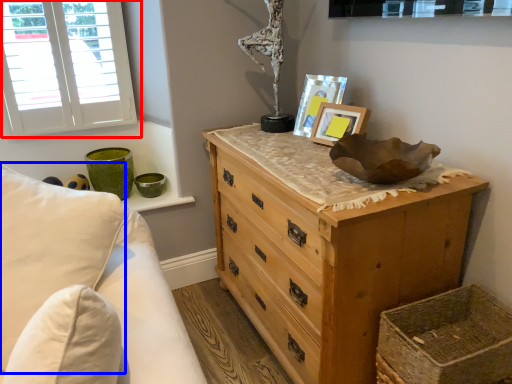
Question: Which object is further to the camera taking this photo, window (highlighted by a red box) or pillow (highlighted by a blue box)?

Choices:
 (A) window
 (B) pillow

Answer: (A)